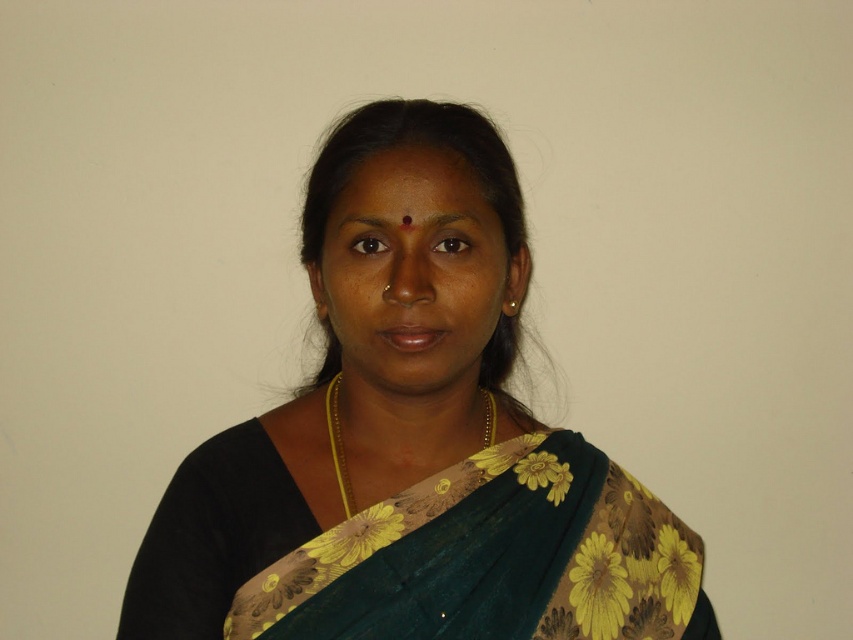
Question: Is green floral saree at center behind matte green saree at center?

Choices:
 (A) yes
 (B) no

Answer: (A)

Question: Which object appears closest to the camera in this image?

Choices:
 (A) gold chain at center
 (B) matte green saree at center

Answer: (B)

Question: Based on their relative distances, which object is nearer to the gold chain at center?

Choices:
 (A) matte green saree at center
 (B) green floral saree at center

Answer: (B)

Question: Can you confirm if green floral saree at center is thinner than gold chain at center?

Choices:
 (A) no
 (B) yes

Answer: (A)

Question: Which object appears farthest from the camera in this image?

Choices:
 (A) green floral saree at center
 (B) gold chain at center
 (C) matte green saree at center

Answer: (B)

Question: Is green floral saree at center thinner than gold chain at center?

Choices:
 (A) yes
 (B) no

Answer: (B)